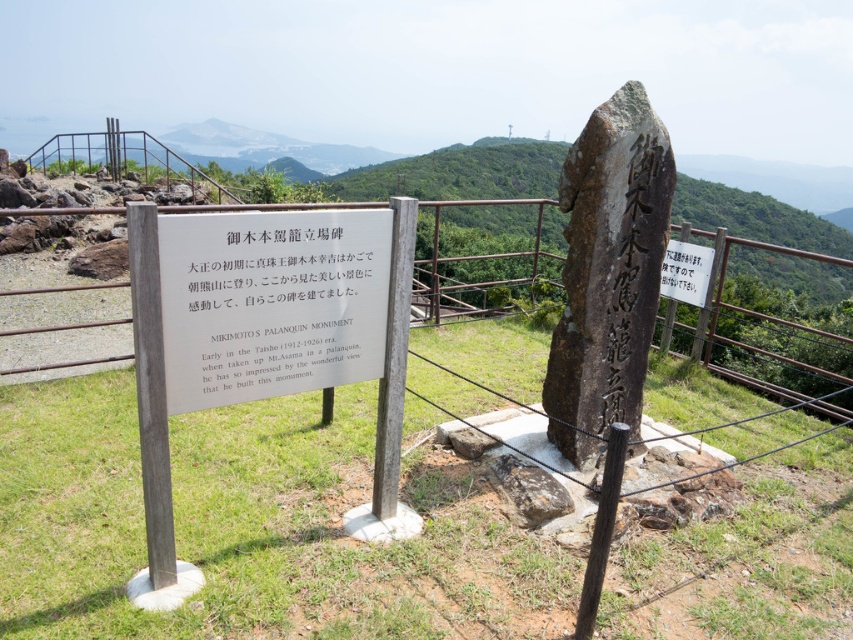
You are a tourist visiting the monument and want to read the signboard. You have a white paper in your hand. If you hold the white paper at center and look towards the metallic silver fence at upper center, which direction should you turn to see the signboard?

The white paper at center is to the left of metallic silver fence at upper center. Since the signboard is to the left of the monument, you should turn to your left to see the signboard.

You are a tourist standing at the base of the monument and want to take a photo of both the metallic silver fence at upper center and the white paper sign at upper center. Since you want to ensure both are fully visible in your photo, which object should you focus on first to frame them properly?

The metallic silver fence at upper center is taller than the white paper sign at upper center, so you should focus on framing the metallic silver fence at upper center first to ensure the entire height of both objects is captured in the photo.

You are standing at the point labeled point (483, 204). Which object are you touching?

You are touching the metallic silver fence at upper center because the point (483, 204) is on it.